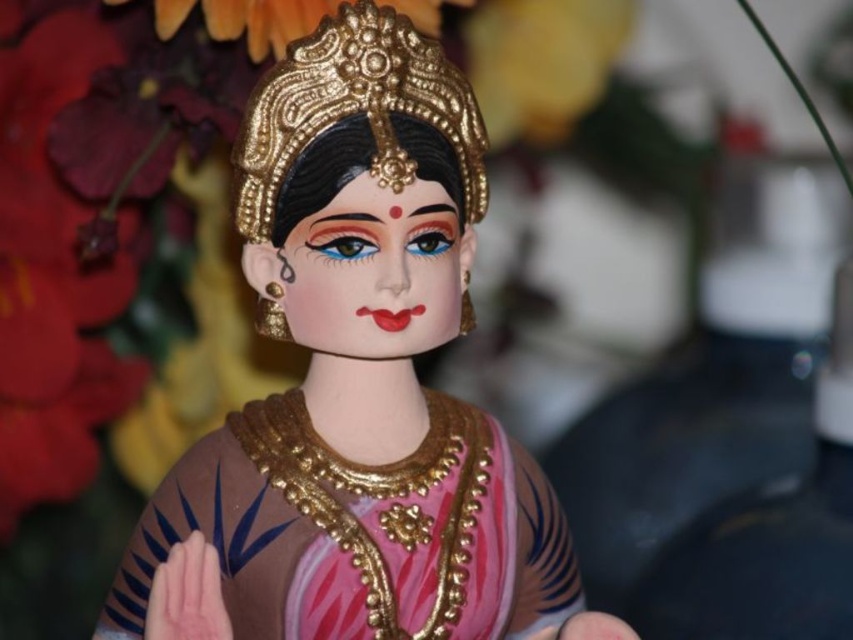
Is matte gold statue at center to the right of gold textured crown at upper center from the viewer's perspective?

Correct, you'll find matte gold statue at center to the right of gold textured crown at upper center.

Looking at this image, is matte gold statue at center further to the viewer compared to gold textured crown at upper center?

No, it is not.

Who is more forward, (306,208) or (292,4)?

Positioned in front is point (306,208).

Find the location of `matte gold statue at center`. matte gold statue at center is located at coordinates (360, 376).